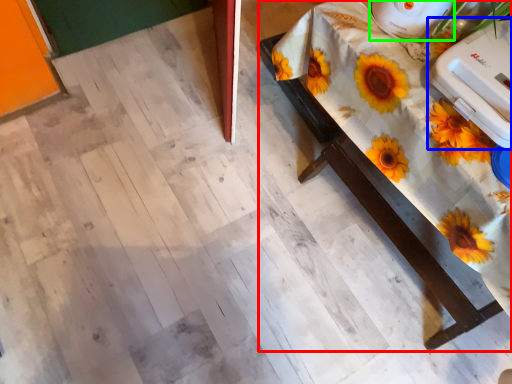
Question: Which is nearer to the table (highlighted by a red box)? appliance (highlighted by a blue box) or appliance (highlighted by a green box).

Choices:
 (A) appliance
 (B) appliance

Answer: (A)